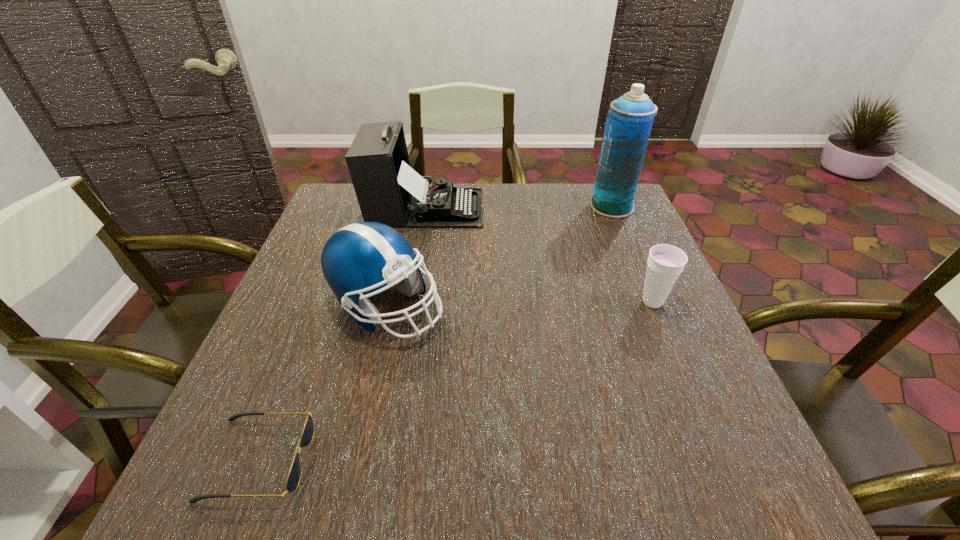
At what (x,y) coordinates should I click in order to perform the action: click on free space between the typewriter and the sunglasses. Please return your answer as a coordinate pair (x, y). Looking at the image, I should click on (342, 334).

Where is `vacant area that lies between the nearest object and the cup`? vacant area that lies between the nearest object and the cup is located at coordinates (x=456, y=381).

This screenshot has width=960, height=540. I want to click on free space between the aerosol can and the second tallest object, so click(518, 207).

The width and height of the screenshot is (960, 540). What are the coordinates of `free spot between the fourth tallest object and the tallest object` in the screenshot? It's located at (632, 254).

This screenshot has height=540, width=960. I want to click on free space that is in between the aerosol can and the football helmet, so click(499, 257).

This screenshot has height=540, width=960. In order to click on unoccupied area between the second tallest object and the fourth tallest object in this screenshot , I will do `click(539, 255)`.

At what (x,y) coordinates should I click in order to perform the action: click on the second closest object to the shortest object. Please return your answer as a coordinate pair (x, y). Looking at the image, I should click on (388, 190).

Identify the location of object that stands as the fourth closest to the typewriter. (293, 479).

You are a GUI agent. You are given a task and a screenshot of the screen. Output one action in this format:
    pyautogui.click(x=<x>, y=<y>)
    Task: Click on the free point that satisfies the following two spatial constraints: 1. on the back side of the cup; 2. inside the open case of the typewriter
    Image resolution: width=960 pixels, height=540 pixels.
    Given the screenshot: What is the action you would take?
    pyautogui.click(x=613, y=208)

You are a GUI agent. You are given a task and a screenshot of the screen. Output one action in this format:
    pyautogui.click(x=<x>, y=<y>)
    Task: Click on the vacant area in the image that satisfies the following two spatial constraints: 1. on the front side of the tallest object; 2. on the left side of the cup
    
    Given the screenshot: What is the action you would take?
    pyautogui.click(x=652, y=302)